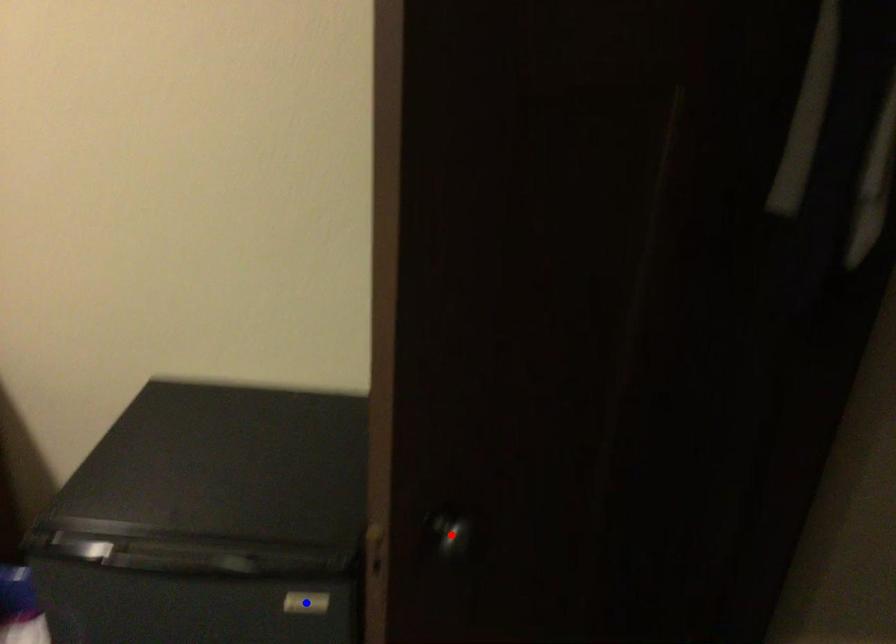
Question: Which of the two points in the image is closer to the camera?

Choices:
 (A) Blue point is closer.
 (B) Red point is closer.

Answer: (B)